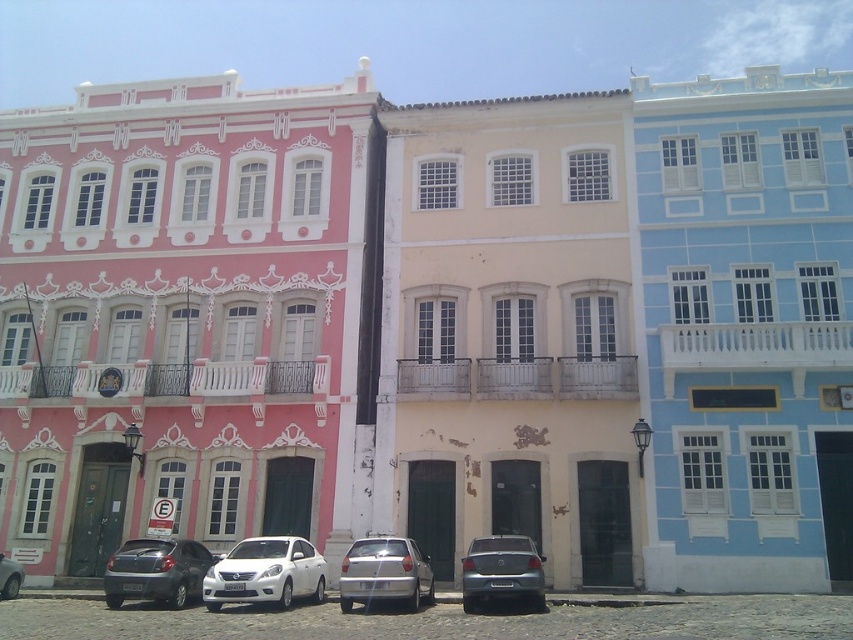
Is white glossy sedan at center closer to camera compared to silver metallic hatchback at center?

Yes, it is in front of silver metallic hatchback at center.

Is white glossy sedan at center thinner than silver metallic hatchback at center?

No.

Which is behind, point (300, 545) or point (407, 580)?

Point (300, 545)

At what (x,y) coordinates should I click in order to perform the action: click on white glossy sedan at center. Please return your answer as a coordinate pair (x, y). The image size is (853, 640). Looking at the image, I should click on (265, 572).

Who is lower down, silver metallic hatchback at center or silver metallic sedan at center?

silver metallic hatchback at center is below.

Does silver metallic hatchback at center have a greater height compared to silver metallic sedan at center?

Yes.

The height and width of the screenshot is (640, 853). Identify the location of silver metallic hatchback at center. (386, 572).

Between metallic gray hatchback at lower left and silver metallic sedan at center, which one appears on the right side from the viewer's perspective?

silver metallic sedan at center is more to the right.

Between metallic gray hatchback at lower left and silver metallic sedan at center, which one has less height?

Standing shorter between the two is silver metallic sedan at center.

This screenshot has width=853, height=640. Find the location of `metallic gray hatchback at lower left`. metallic gray hatchback at lower left is located at coordinates (155, 572).